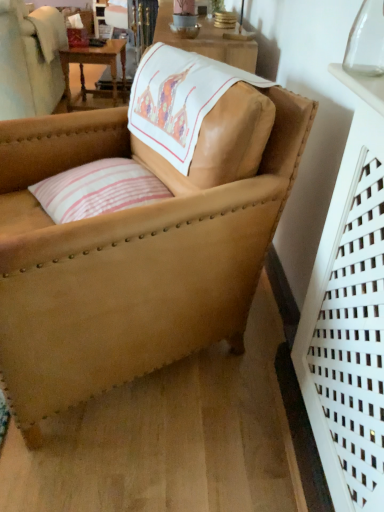
Question: Is transparent glass vase at upper right at the right side of wooden table at upper left?

Choices:
 (A) yes
 (B) no

Answer: (A)

Question: Considering the relative sizes of transparent glass vase at upper right and wooden table at upper left in the image provided, is transparent glass vase at upper right smaller than wooden table at upper left?

Choices:
 (A) yes
 (B) no

Answer: (A)

Question: From the image's perspective, is transparent glass vase at upper right below wooden table at upper left?

Choices:
 (A) yes
 (B) no

Answer: (A)

Question: From a real-world perspective, does transparent glass vase at upper right sit lower than wooden table at upper left?

Choices:
 (A) yes
 (B) no

Answer: (B)

Question: Would you say transparent glass vase at upper right contains wooden table at upper left?

Choices:
 (A) yes
 (B) no

Answer: (B)

Question: Is leather armchair at center inside the boundaries of wooden table at upper left, or outside?

Choices:
 (A) outside
 (B) inside

Answer: (A)

Question: Is point (205, 339) positioned closer to the camera than point (82, 48)?

Choices:
 (A) farther
 (B) closer

Answer: (B)

Question: From the image's perspective, relative to wooden table at upper left, is leather armchair at center above or below?

Choices:
 (A) above
 (B) below

Answer: (B)

Question: Visually, is leather armchair at center positioned to the left or to the right of wooden table at upper left?

Choices:
 (A) right
 (B) left

Answer: (A)

Question: In terms of height, does pink striped fabric pillow at center look taller or shorter compared to leather armchair at center?

Choices:
 (A) short
 (B) tall

Answer: (A)

Question: From the image's perspective, is pink striped fabric pillow at center above or below leather armchair at center?

Choices:
 (A) above
 (B) below

Answer: (A)

Question: Considering the positions of pink striped fabric pillow at center and leather armchair at center in the image, is pink striped fabric pillow at center bigger or smaller than leather armchair at center?

Choices:
 (A) big
 (B) small

Answer: (B)

Question: Do you think pink striped fabric pillow at center is within leather armchair at center, or outside of it?

Choices:
 (A) outside
 (B) inside

Answer: (B)

Question: Is wooden table at upper left spatially inside transparent glass vase at upper right, or outside of it?

Choices:
 (A) outside
 (B) inside

Answer: (A)

Question: Is wooden table at upper left in front of or behind transparent glass vase at upper right in the image?

Choices:
 (A) behind
 (B) front

Answer: (A)